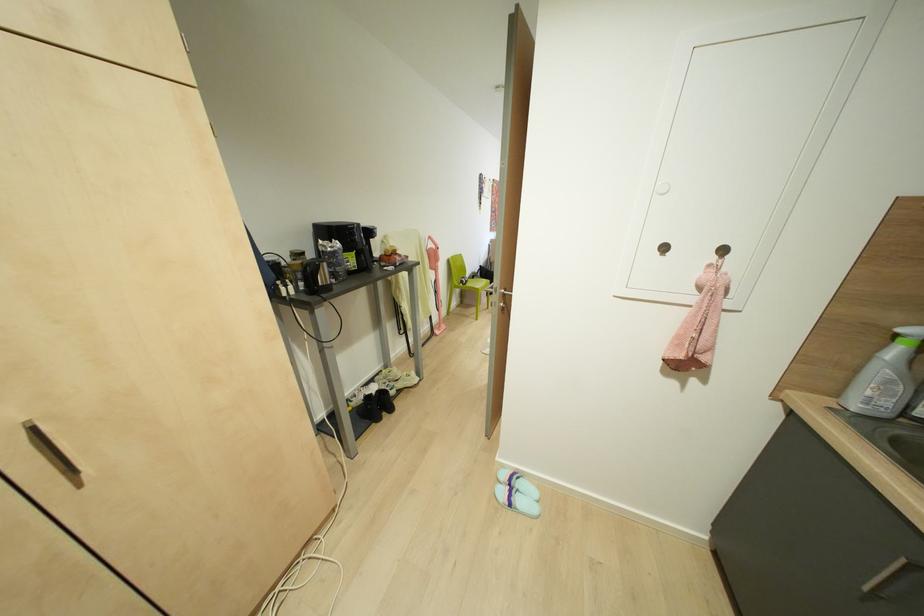
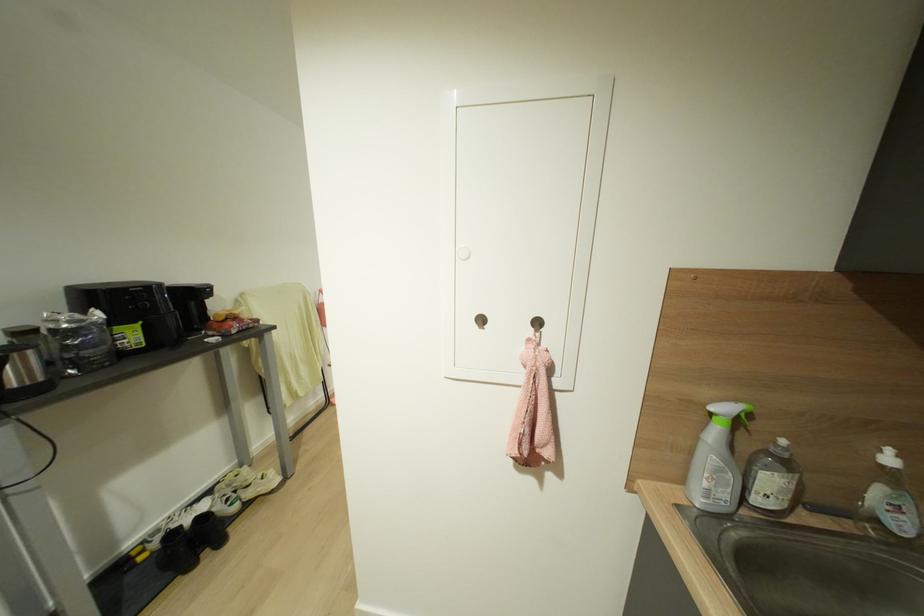
Locate, in the second image, the point that corresponds to the point at 895,334 in the first image.

(711, 411)